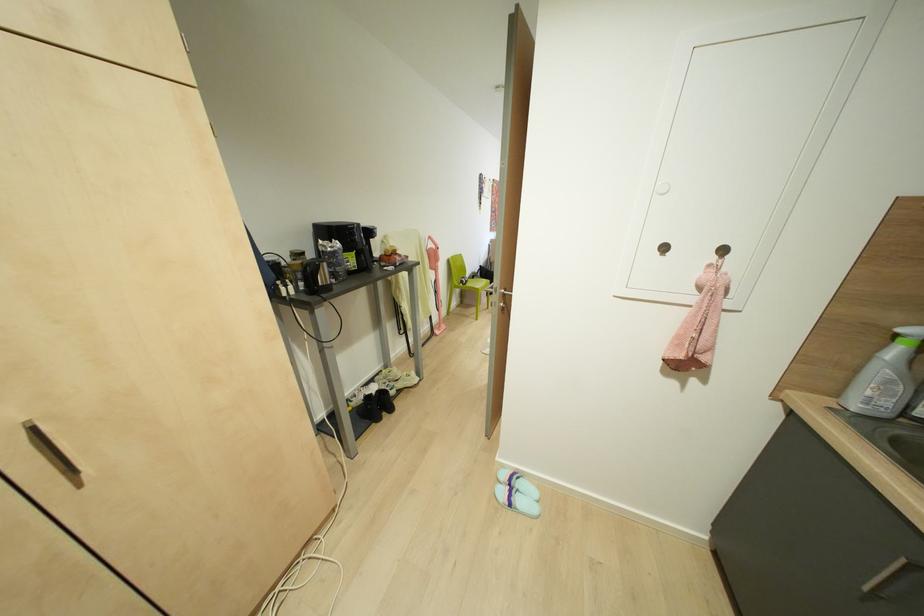
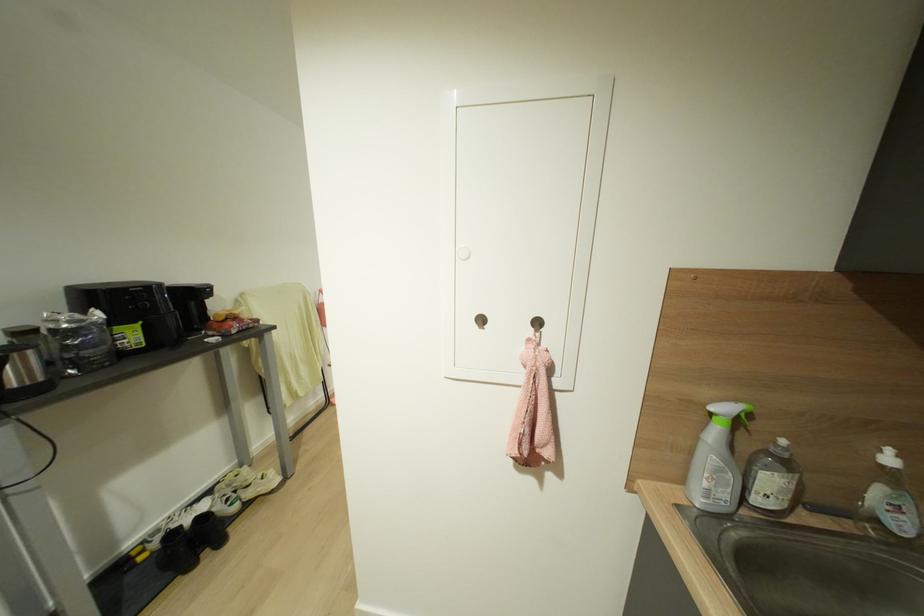
Locate, in the second image, the point that corresponds to the point at 895,334 in the first image.

(711, 411)